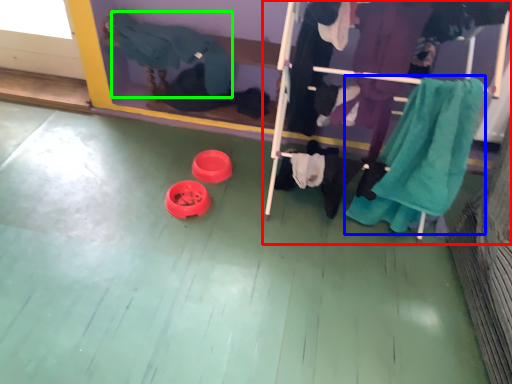
Question: Which is nearer to the furniture (highlighted by a red box)? clothing (highlighted by a blue box) or clothing (highlighted by a green box).

Choices:
 (A) clothing
 (B) clothing

Answer: (A)